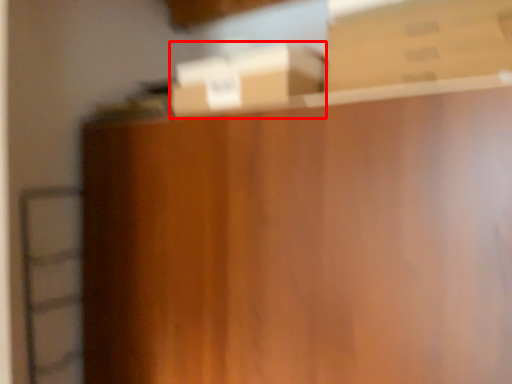
Question: From the image's perspective, where is box (annotated by the red box) located in relation to box in the image?

Choices:
 (A) below
 (B) above

Answer: (A)